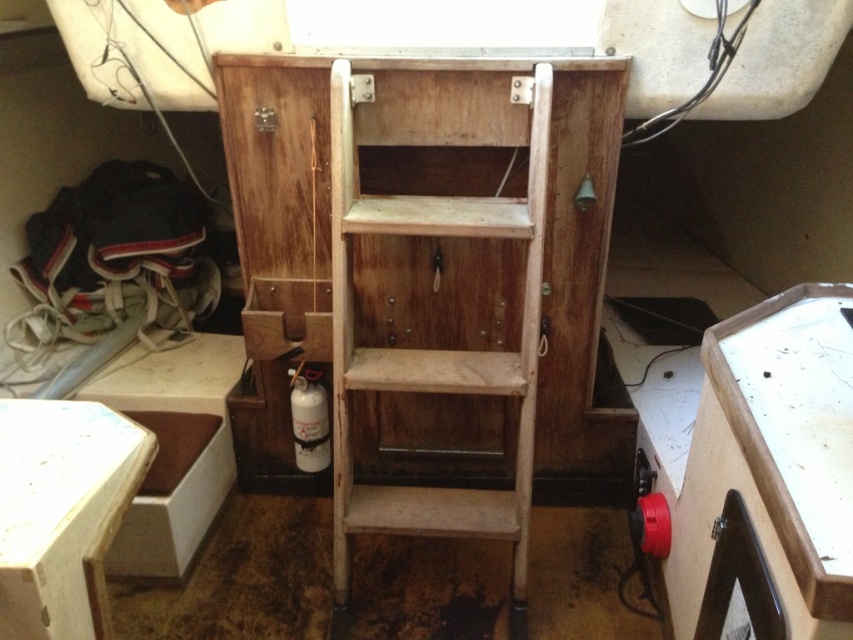
Question: Which object is farther from the camera taking this photo?

Choices:
 (A) white matte stool at lower left
 (B) white matte gas canister at lower center
 (C) wooden drawer at center

Answer: (B)

Question: Does white matte stool at lower left appear on the left side of white matte gas canister at lower center?

Choices:
 (A) no
 (B) yes

Answer: (B)

Question: Among these objects, which one is farthest from the camera?

Choices:
 (A) white matte stool at lower left
 (B) worn wood shelf at center
 (C) wooden drawer at center
 (D) white matte gas canister at lower center

Answer: (D)

Question: Does worn wood shelf at center appear over white matte stool at lower left?

Choices:
 (A) no
 (B) yes

Answer: (B)

Question: Can you confirm if worn wood shelf at center is thinner than white matte gas canister at lower center?

Choices:
 (A) no
 (B) yes

Answer: (A)

Question: Which object is positioned closest to the white matte stool at lower left?

Choices:
 (A) wooden drawer at center
 (B) white matte gas canister at lower center

Answer: (A)